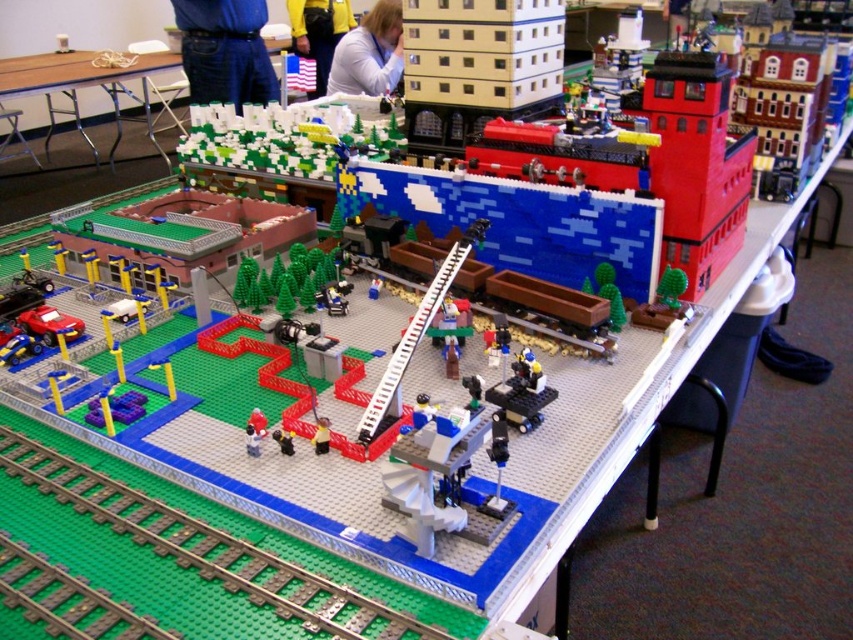
Who is more forward, (x=148, y=515) or (x=279, y=445)?

Point (x=148, y=515) is in front.

Who is higher up, green plastic train track at bottom or smooth plastic toy at center?

Positioned higher is smooth plastic toy at center.

You are a GUI agent. You are given a task and a screenshot of the screen. Output one action in this format:
    pyautogui.click(x=<x>, y=<y>)
    Task: Click on the green plastic train track at bottom
    
    Given the screenshot: What is the action you would take?
    pyautogui.click(x=206, y=547)

Locate an element on the screen. green plastic train track at bottom is located at coordinates (206, 547).

Who is shorter, yellow plastic figure at center or smooth plastic toy at center?

Standing shorter between the two is smooth plastic toy at center.

Which is in front, point (315, 452) or point (293, 451)?

Point (293, 451)

The height and width of the screenshot is (640, 853). Find the location of `yellow plastic figure at center`. yellow plastic figure at center is located at coordinates (321, 435).

Image resolution: width=853 pixels, height=640 pixels. Find the location of `yellow plastic figure at center`. yellow plastic figure at center is located at coordinates (321, 435).

Is green plastic train track at bottom below blue denim pants at upper center?

Yes, green plastic train track at bottom is below blue denim pants at upper center.

Where is `green plastic train track at bottom`? Image resolution: width=853 pixels, height=640 pixels. green plastic train track at bottom is located at coordinates (206, 547).